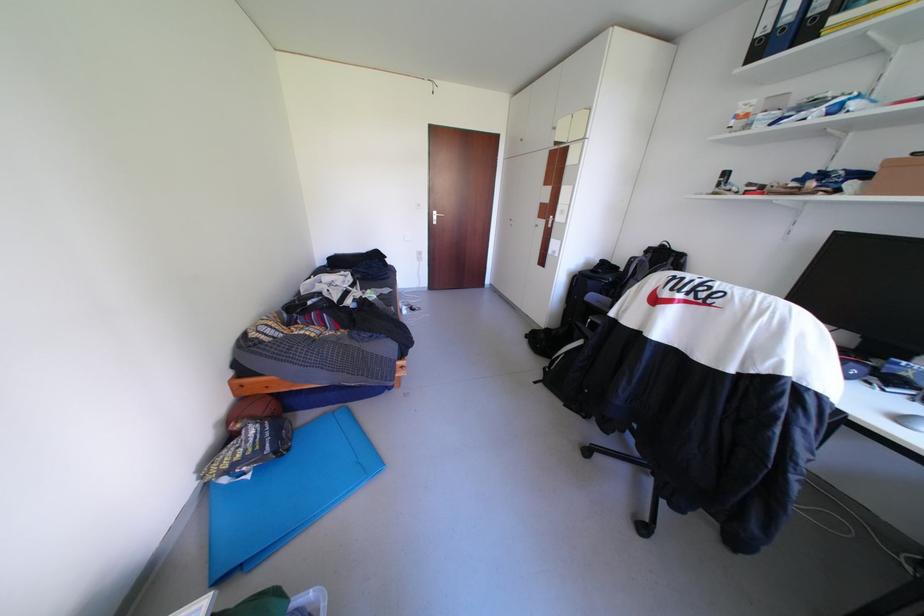
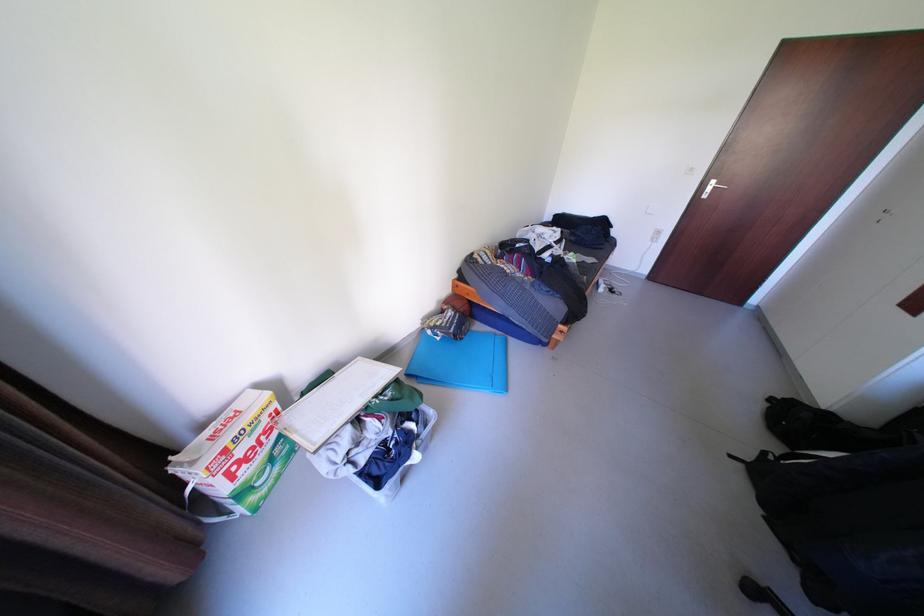
Where in the second image is the point corresponding to (552,384) from the first image?

(752, 466)